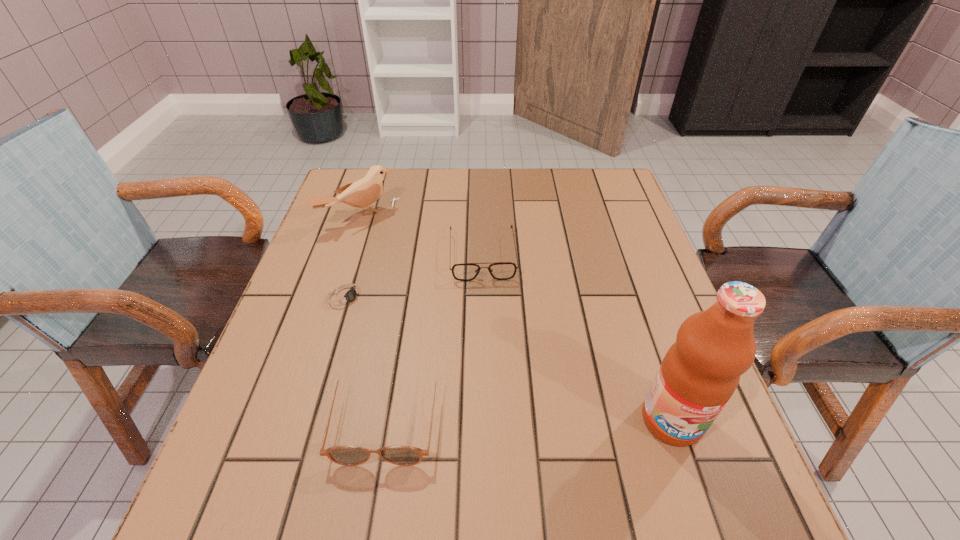
The width and height of the screenshot is (960, 540). In order to click on bird situated at the left edge in this screenshot , I will do `click(363, 193)`.

Where is `object located in the right edge section of the desktop`? Image resolution: width=960 pixels, height=540 pixels. object located in the right edge section of the desktop is located at coordinates (700, 372).

Locate an element on the screen. The image size is (960, 540). object that is at the far left corner is located at coordinates (363, 193).

Where is `object present at the near right corner`? This screenshot has height=540, width=960. object present at the near right corner is located at coordinates (700, 372).

Locate an element on the screen. The height and width of the screenshot is (540, 960). free spot at the far edge of the desktop is located at coordinates (456, 178).

This screenshot has height=540, width=960. I want to click on free region at the near edge of the desktop, so click(371, 434).

I want to click on vacant space at the left edge of the desktop, so click(x=362, y=265).

Locate an element on the screen. vacant space at the right edge of the desktop is located at coordinates (637, 240).

Identify the location of vacant space at the near right corner of the desktop. The width and height of the screenshot is (960, 540). (660, 447).

You are a GUI agent. You are given a task and a screenshot of the screen. Output one action in this format:
    pyautogui.click(x=<x>, y=<y>)
    Task: Click on the vacant area that lies between the watch and the tallest object
    This screenshot has width=960, height=540.
    Given the screenshot: What is the action you would take?
    pyautogui.click(x=509, y=357)